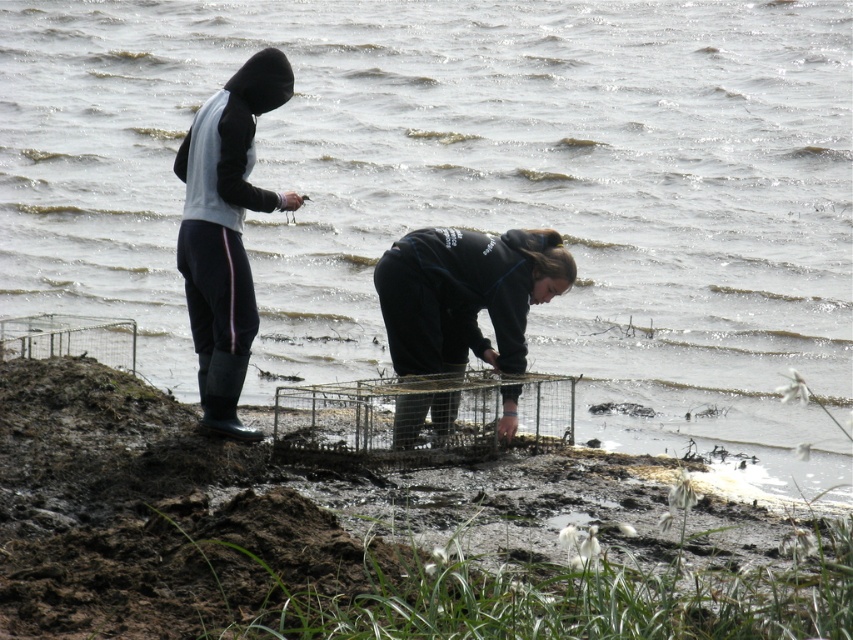
You are trying to determine the position of the rubber boots at left relative to the black matte jacket at lower center. Which object is closer to the viewer?

The black matte jacket at lower center is closer to the viewer than the rubber boots at left.

You are a researcher trying to reach the metallic wire birdcage at center from the black matte jacket at lower center. Which direction should you move?

The black matte jacket at lower center is closer to you than the metallic wire birdcage at center, so you should move forward to reach the metallic wire birdcage at center.

From the picture: Based on the coordinates provided, which part of the person at left is located at point (225,230)?

The point at (225,230) is on the rubber boots at left.